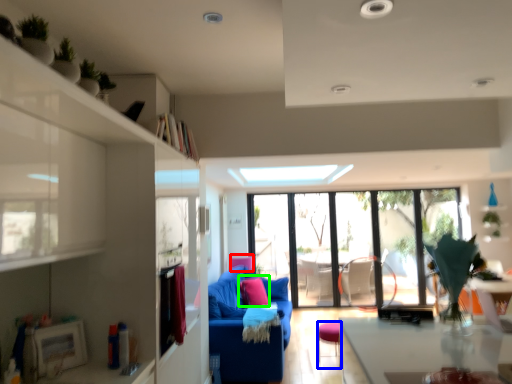
Question: Which is farther away from armchair (highlighted by a red box)? stool (highlighted by a blue box) or pillow (highlighted by a green box)?

Choices:
 (A) stool
 (B) pillow

Answer: (A)